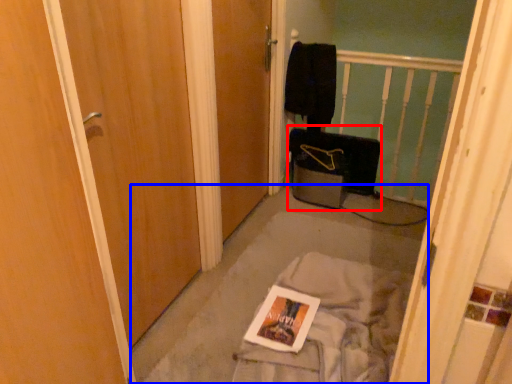
Question: Among these objects, which one is nearest to the camera, luggage (highlighted by a red box) or concrete (highlighted by a blue box)?

Choices:
 (A) luggage
 (B) concrete

Answer: (B)